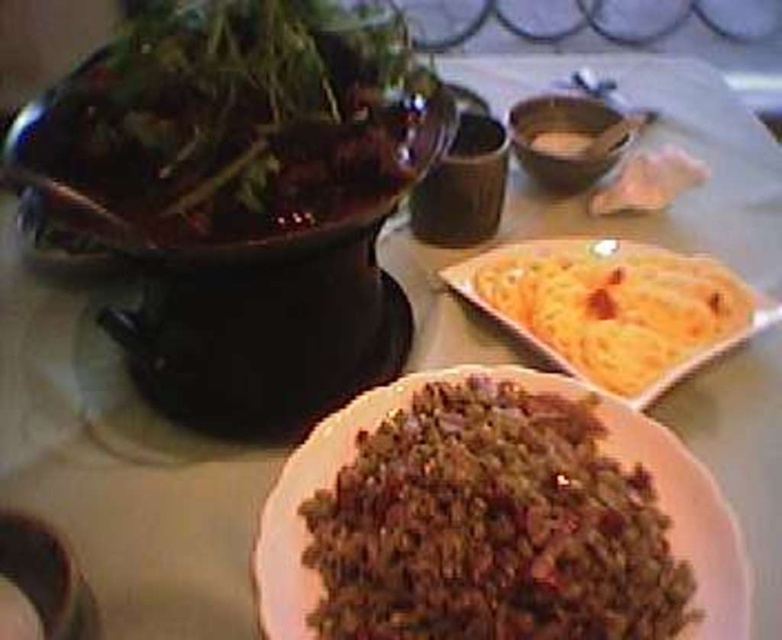
Between brown matte ground beef at lower center and yellow crispy flatbread at upper right, which one appears on the left side from the viewer's perspective?

Positioned to the left is brown matte ground beef at lower center.

Does brown matte ground beef at lower center have a larger size compared to yellow crispy flatbread at upper right?

No.

What are the coordinates of `brown matte ground beef at lower center` in the screenshot? It's located at (490, 525).

Does yellow crispy flatbread at upper right appear on the right side of matte brown bowl at upper center?

In fact, yellow crispy flatbread at upper right is to the left of matte brown bowl at upper center.

Which of these two, yellow crispy flatbread at upper right or matte brown bowl at upper center, stands taller?

yellow crispy flatbread at upper right is taller.

Between point (508, 269) and point (553, 148), which one is positioned behind?

Positioned behind is point (553, 148).

The height and width of the screenshot is (640, 782). Find the location of `yellow crispy flatbread at upper right`. yellow crispy flatbread at upper right is located at coordinates (614, 308).

Does matte brown bowl at upper center have a greater width compared to white matte flatbread at upper right?

Indeed, matte brown bowl at upper center has a greater width compared to white matte flatbread at upper right.

Between point (590, 168) and point (626, 134), which one is positioned in front?

Positioned in front is point (590, 168).

What do you see at coordinates (567, 140) in the screenshot?
I see `matte brown bowl at upper center` at bounding box center [567, 140].

I want to click on matte brown bowl at upper center, so click(567, 140).